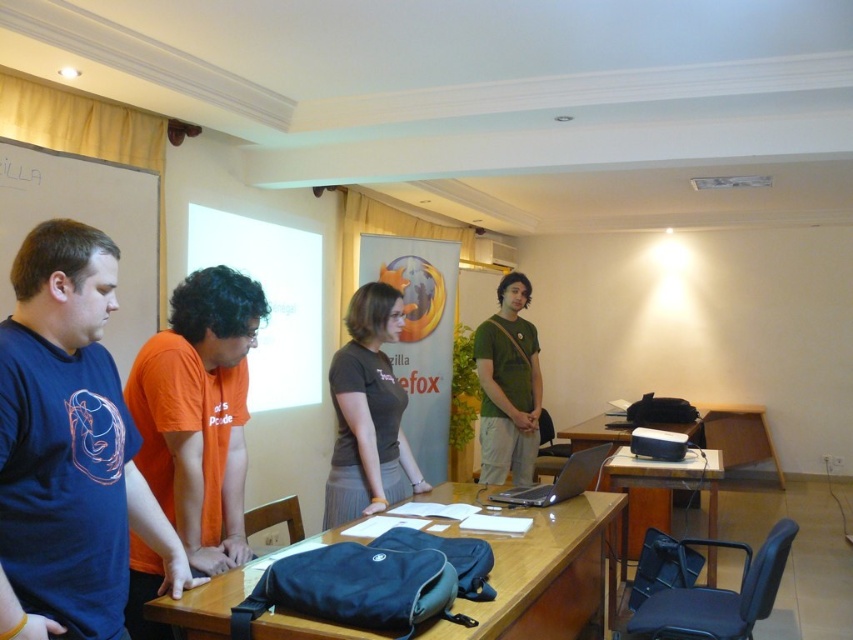
You are organizing a small event and need to place a 12 inch wide decorative item between the blue fabric bag at center and the matte gray shirt at center. Will there be enough space?

The blue fabric bag at center and matte gray shirt at center are 19.08 inches apart, so yes, placing a 12 inch wide decorative item between them will fit as there is sufficient space.

You are organizing a small event and need to place a blue fabric bag at center and a matte gray shirt at center on a shelf. Which item should you place first if you want to stack them vertically?

The blue fabric bag at center has a lesser height compared to matte gray shirt at center, so you should place the blue fabric bag at center first to ensure stability when stacking them vertically.